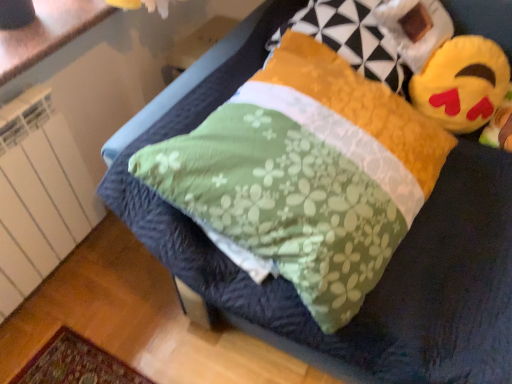
Question: From a real-world perspective, relative to yellow plush toy at upper right, is fluffy yellow pillow at upper right vertically above or below?

Choices:
 (A) below
 (B) above

Answer: (B)

Question: Is fluffy yellow pillow at upper right situated inside yellow plush toy at upper right or outside?

Choices:
 (A) inside
 (B) outside

Answer: (B)

Question: Considering the real-world distances, which object is farthest from the white glossy countertop at upper left?

Choices:
 (A) yellow plush toy at upper right
 (B) fluffy yellow pillow at upper right

Answer: (A)

Question: Based on their relative distances, which object is nearer to the fluffy yellow pillow at upper right?

Choices:
 (A) white glossy countertop at upper left
 (B) yellow plush toy at upper right

Answer: (B)